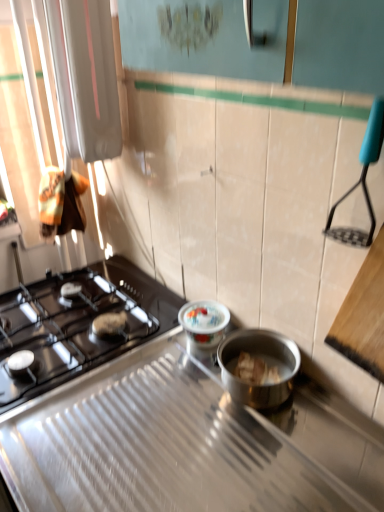
Question: From the image's perspective, is porcelain floral-patterned container at center above or below black glass gas stove at left, the second gas stove from the front?

Choices:
 (A) above
 (B) below

Answer: (A)

Question: Is point (195, 318) closer or farther from the camera than point (139, 308)?

Choices:
 (A) farther
 (B) closer

Answer: (B)

Question: Which of these objects is positioned closest to the porcelain floral-patterned container at center?

Choices:
 (A) black matte gas stove at left, which is the second gas stove from back to front
 (B) black glass gas stove at left, placed as the 1th gas stove when sorted from back to front

Answer: (A)

Question: Based on their relative distances, which object is nearer to the black glass gas stove at left, the second gas stove from the front?

Choices:
 (A) porcelain floral-patterned container at center
 (B) black matte gas stove at left, which is counted as the 1th gas stove, starting from the front

Answer: (B)